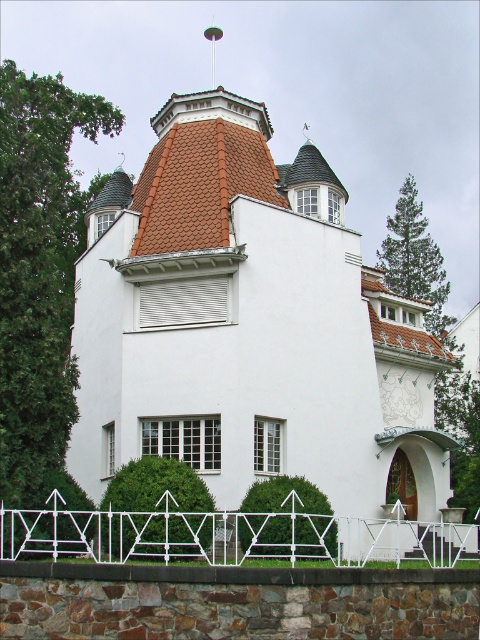
You are a delivery person approaching the white smooth house at center and the white metal fence at lower center. Which object will you encounter first as you move towards the house?

The white metal fence at lower center will be encountered first since it is positioned below the white smooth house at center, meaning it is closer to the viewer and the path of approach.

You are standing in front of the house and want to determine the relative positions of two points marked on its facade. The first point is at coordinate point [228,456] and the second is at point [117,518]. Which point is closer to you?

Point [228,456] is closer to you because it is further to the viewer than point [117,518].

You are standing in the garden of the house and want to walk from the white metal fence at lower center to the white smooth house at center. Which direction should you face to walk directly towards the house?

You should face to the left since the white smooth house at center is located to the left of the white metal fence at lower center.